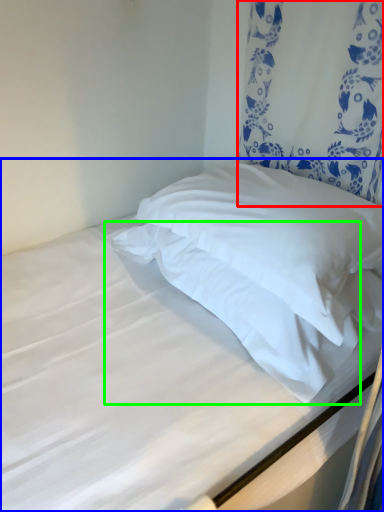
Question: Which object is the closest to the curtain (highlighted by a red box)? Choose among these: bed (highlighted by a blue box) or pillow (highlighted by a green box).

Choices:
 (A) bed
 (B) pillow

Answer: (A)